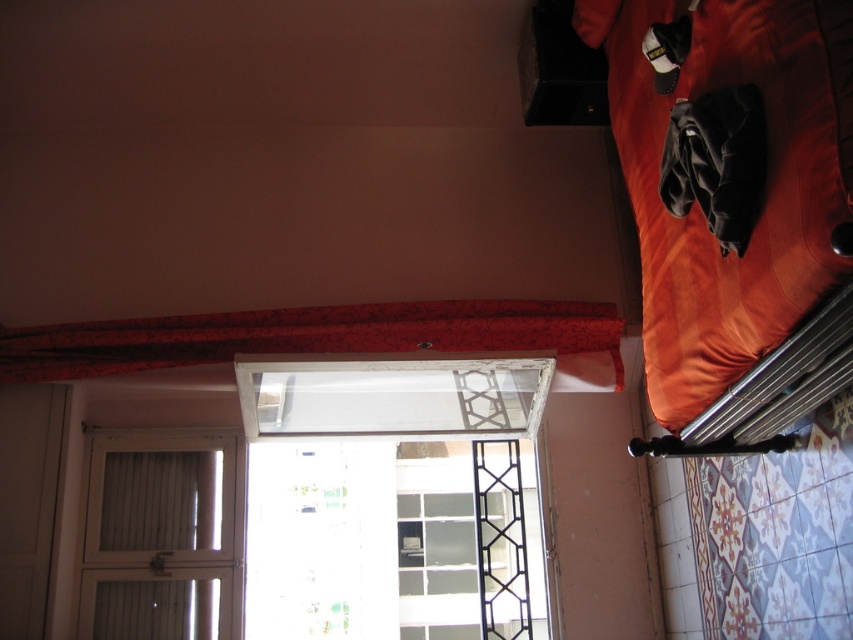
You are standing in the room and want to look through the clear glass window at center. Where should you stand to see the point at coordinates (392, 497) on the window?

The point at coordinates (392, 497) is on the clear glass window at center, so you should stand directly in front of the clear glass window at center to see it.

You are standing in the room and want to look out the clear glass window at center. Based on its 2D coordinates, in which general direction should you turn your head to see it?

The clear glass window at center is located at coordinates approximately 0.777 on the x axis and 0.460 on the y axis. Since the x value is closer to 1, this indicates the window is positioned more to the right side of the room. Therefore, you should turn your head to the right to see the clear glass window at center.